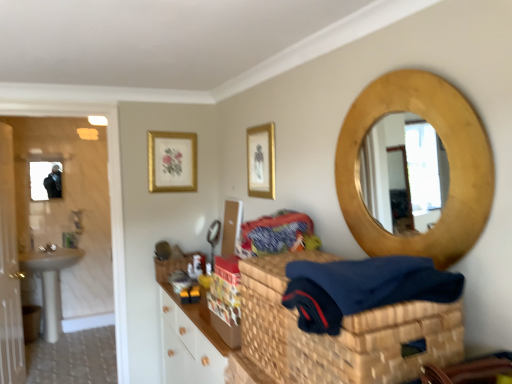
Question: From a real-world perspective, does gold metallic picture frame at upper center, acting as the 2th picture frame starting from the left, stand above white glossy sink at left?

Choices:
 (A) no
 (B) yes

Answer: (B)

Question: Is gold metallic picture frame at upper center, the 1th picture frame in the right-to-left sequence, taller than white glossy sink at left?

Choices:
 (A) no
 (B) yes

Answer: (A)

Question: Does gold metallic picture frame at upper center, marked as the 2th picture frame in a back-to-front arrangement, touch white glossy sink at left?

Choices:
 (A) no
 (B) yes

Answer: (A)

Question: Is gold metallic picture frame at upper center, acting as the 2th picture frame starting from the left, to the right of white glossy sink at left from the viewer's perspective?

Choices:
 (A) no
 (B) yes

Answer: (B)

Question: From a real-world perspective, is gold metallic picture frame at upper center, the 1th picture frame when ordered from front to back, below white glossy sink at left?

Choices:
 (A) yes
 (B) no

Answer: (B)

Question: Does gold metallic picture frame at upper center, the 1th picture frame in the right-to-left sequence, have a smaller size compared to white glossy sink at left?

Choices:
 (A) yes
 (B) no

Answer: (A)

Question: Considering the relative positions of white glossy door at left and white glossy sink at left in the image provided, is white glossy door at left to the right of white glossy sink at left from the viewer's perspective?

Choices:
 (A) yes
 (B) no

Answer: (A)

Question: Can you confirm if white glossy door at left is shorter than white glossy sink at left?

Choices:
 (A) yes
 (B) no

Answer: (B)

Question: From a real-world perspective, is white glossy door at left beneath white glossy sink at left?

Choices:
 (A) yes
 (B) no

Answer: (B)

Question: Is white glossy door at left thinner than white glossy sink at left?

Choices:
 (A) no
 (B) yes

Answer: (B)

Question: Would you say white glossy door at left is outside white glossy sink at left?

Choices:
 (A) no
 (B) yes

Answer: (B)

Question: Is white glossy door at left in front of white glossy sink at left?

Choices:
 (A) yes
 (B) no

Answer: (A)

Question: From a real-world perspective, is woven straw basket at center located beneath patterned fabric at center?

Choices:
 (A) no
 (B) yes

Answer: (B)